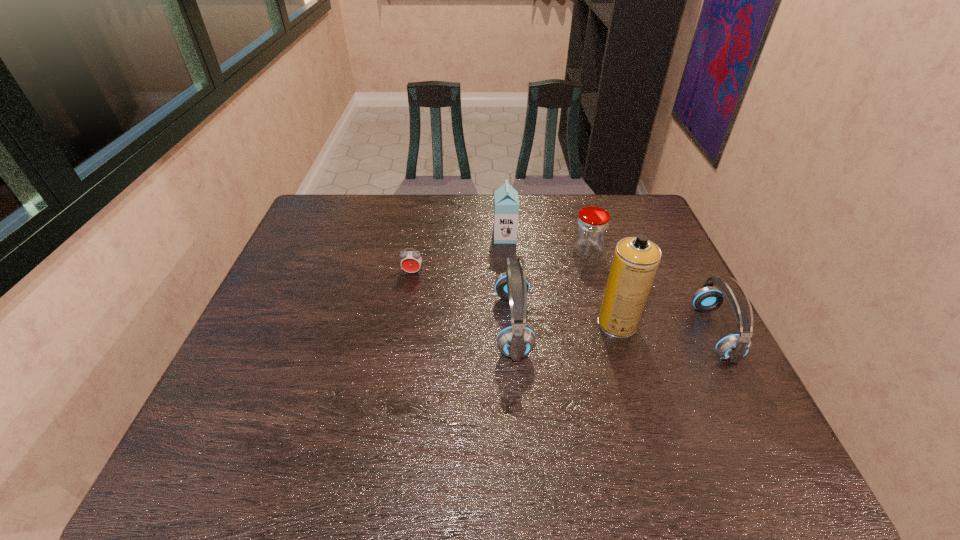
Locate an element on the screen. vacant spot to place a headset on the left is located at coordinates (319, 318).